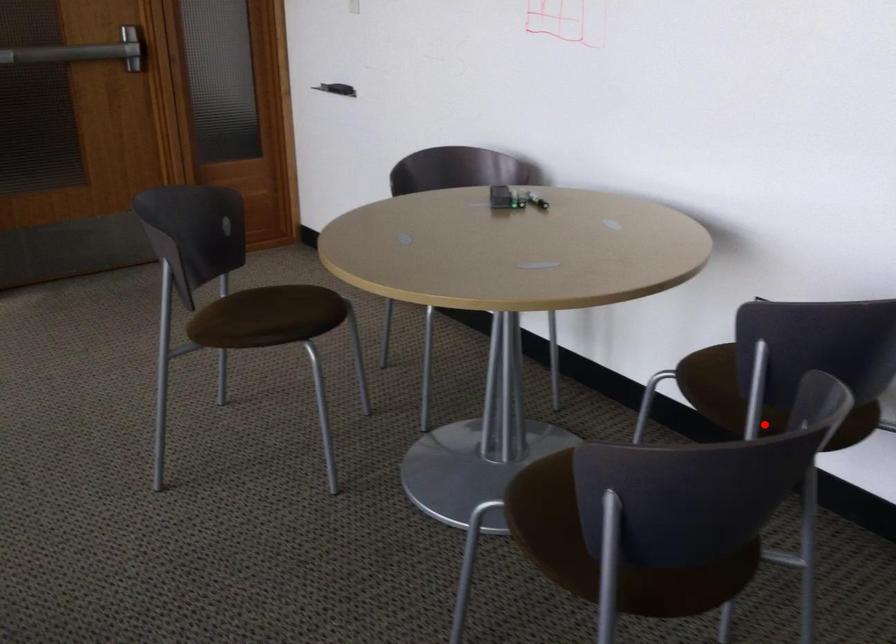
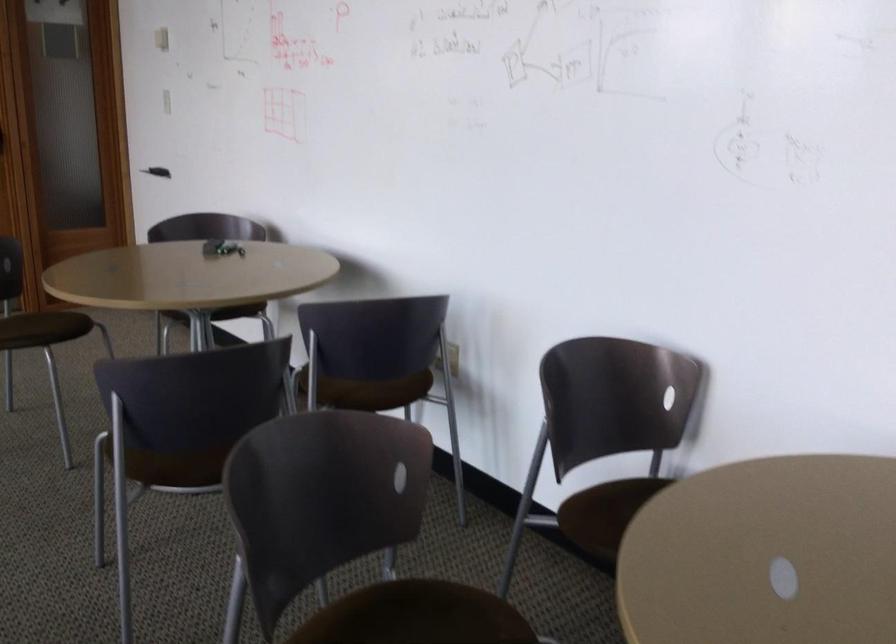
Where in the second image is the point corresponding to the highlighted location from the first image?

(347, 392)